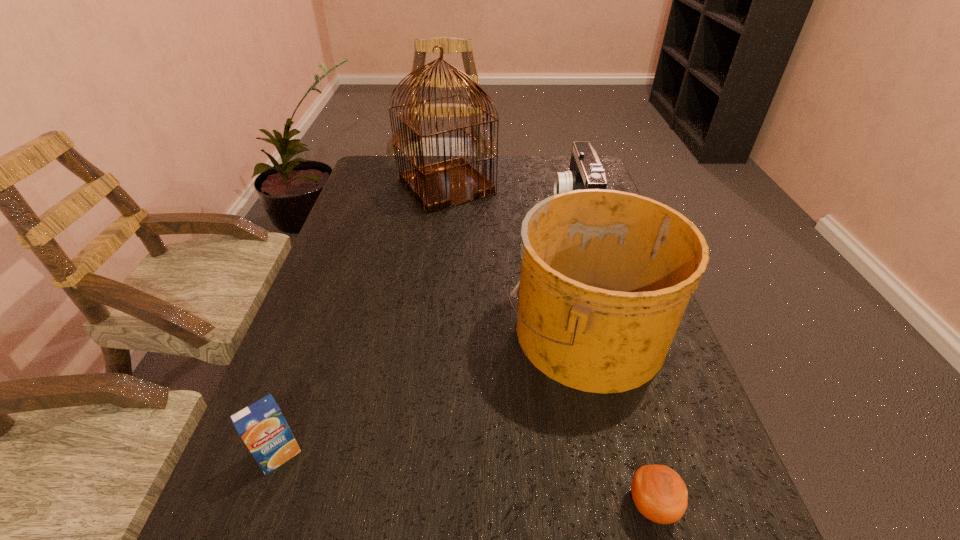
Find the location of `the tallest object`. the tallest object is located at coordinates (445, 184).

What are the coordinates of `the fourth object from right to left` in the screenshot? It's located at (445, 184).

Identify the location of the second tallest object. (606, 275).

The height and width of the screenshot is (540, 960). I want to click on the third farthest object, so click(606, 275).

Image resolution: width=960 pixels, height=540 pixels. In order to click on the third shortest object in this screenshot , I will do `click(585, 172)`.

The height and width of the screenshot is (540, 960). What are the coordinates of `the second shortest object` in the screenshot? It's located at (261, 425).

The height and width of the screenshot is (540, 960). Identify the location of the leftmost object. (261, 425).

Find the location of a particular element. The image size is (960, 540). the shortest object is located at coordinates (659, 493).

This screenshot has width=960, height=540. What are the coordinates of `the nearest object` in the screenshot? It's located at (659, 493).

The width and height of the screenshot is (960, 540). What are the coordinates of `free region located on the back of the birdcage` in the screenshot? It's located at (450, 156).